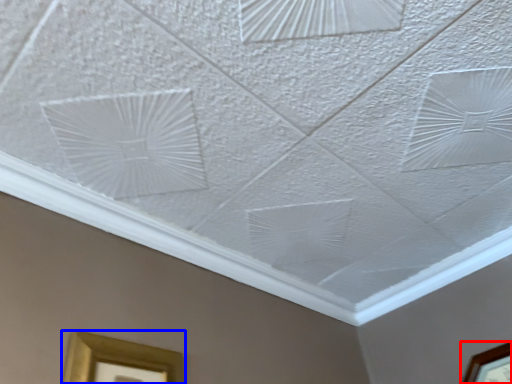
Question: Which point is closer to the camera, picture frame (highlighted by a red box) or picture frame (highlighted by a blue box)?

Choices:
 (A) picture frame
 (B) picture frame

Answer: (B)